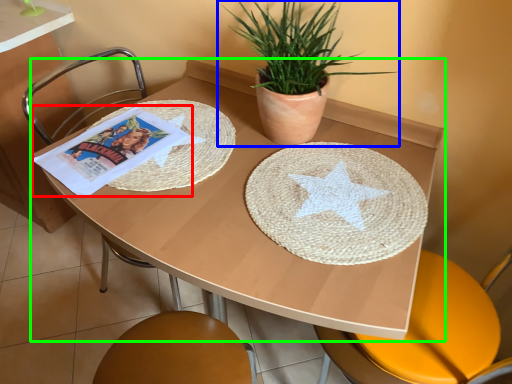
Question: Based on their relative distances, which object is farther from comic book (highlighted by a red box)? Choose from houseplant (highlighted by a blue box) and table (highlighted by a green box).

Choices:
 (A) houseplant
 (B) table

Answer: (A)